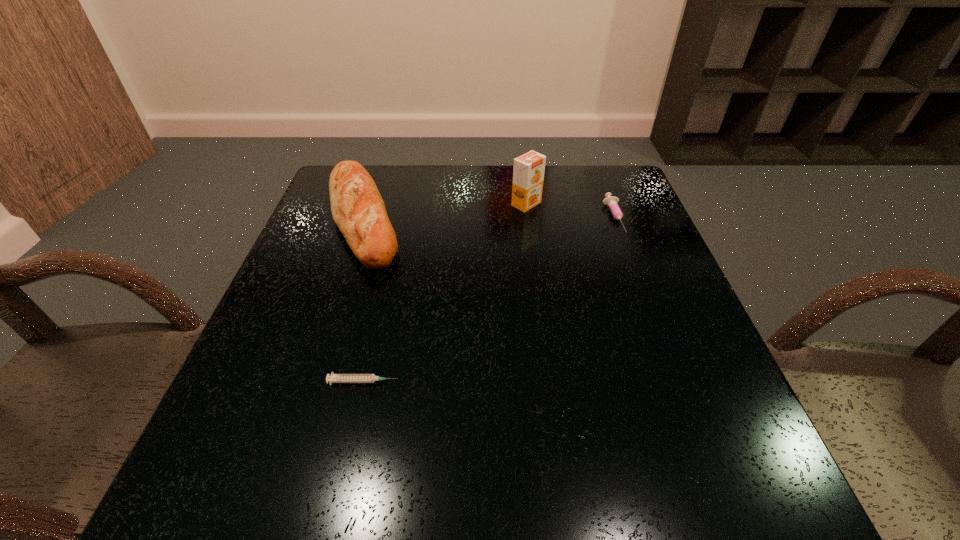
You are a GUI agent. You are given a task and a screenshot of the screen. Output one action in this format:
    pyautogui.click(x=<x>, y=<y>)
    Task: Click on the empty location between the second tallest object and the left syringe
    Image resolution: width=960 pixels, height=540 pixels.
    Given the screenshot: What is the action you would take?
    coord(363,300)

This screenshot has height=540, width=960. In order to click on free space that is in between the tallest object and the right syringe in this screenshot , I will do `click(570, 211)`.

Identify the location of free point between the shorter syringe and the third shortest object. The width and height of the screenshot is (960, 540). (363, 300).

This screenshot has height=540, width=960. Find the location of `vacant area that lies between the right syringe and the orange juice`. vacant area that lies between the right syringe and the orange juice is located at coordinates [x=570, y=211].

Find the location of `object that stands as the second closest to the second shortest object`. object that stands as the second closest to the second shortest object is located at coordinates [x=358, y=210].

The height and width of the screenshot is (540, 960). In order to click on object that is the third closest to the second object from right to left in this screenshot , I will do `click(333, 378)`.

At what (x,y) coordinates should I click in order to perform the action: click on vacant space that satisfies the following two spatial constraints: 1. on the front side of the right syringe; 2. on the left side of the third object from left to right. Please return your answer as a coordinate pair (x, y). The image size is (960, 540). Looking at the image, I should click on (528, 217).

Locate an element on the screen. This screenshot has width=960, height=540. vacant space that satisfies the following two spatial constraints: 1. on the back side of the baguet; 2. on the right side of the second shortest object is located at coordinates (363, 217).

At what (x,y) coordinates should I click in order to perform the action: click on free space that satisfies the following two spatial constraints: 1. on the back side of the second object from right to left; 2. on the right side of the baguet. Please return your answer as a coordinate pair (x, y). This screenshot has height=540, width=960. Looking at the image, I should click on (368, 204).